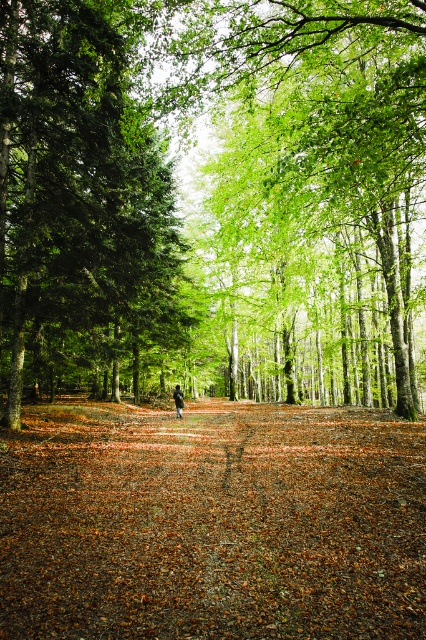
Which is behind, point (109, 504) or point (170, 196)?

The point (170, 196) is more distant.

Is point (135, 483) positioned in front of point (144, 120)?

Yes.

Where is `brown dirt path at center`? brown dirt path at center is located at coordinates (212, 522).

Which is above, green matte tree at center or dark brown leather jacket at center?

green matte tree at center is above.

Is green matte tree at center to the left of dark brown leather jacket at center from the viewer's perspective?

Indeed, green matte tree at center is positioned on the left side of dark brown leather jacket at center.

Is point (40, 100) positioned before point (180, 412)?

Yes, point (40, 100) is closer to viewer.

At what (x,y) coordinates should I click in order to perform the action: click on green matte tree at center. Please return your answer as a coordinate pair (x, y). This screenshot has width=426, height=640. Looking at the image, I should click on (78, 198).

Which is more to the left, green leafy trees at center or green matte tree at center?

green matte tree at center

Is green leafy trees at center thinner than green matte tree at center?

In fact, green leafy trees at center might be wider than green matte tree at center.

Does point (411, 397) come in front of point (86, 305)?

That is False.

Where is `green leafy trees at center`? The width and height of the screenshot is (426, 640). green leafy trees at center is located at coordinates (213, 198).